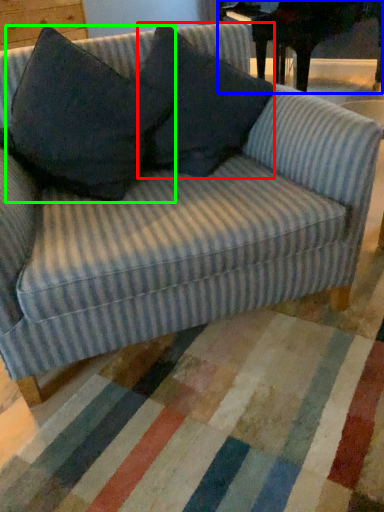
Question: Considering the real-world distances, which object is farthest from throw pillow (highlighted by a red box)? table (highlighted by a blue box) or throw pillow (highlighted by a green box)?

Choices:
 (A) table
 (B) throw pillow

Answer: (A)